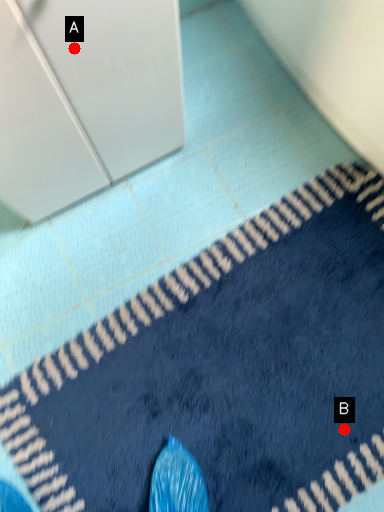
Question: Two points are circled on the image, labeled by A and B beside each circle. Which point is closer to the camera?

Choices:
 (A) A is closer
 (B) B is closer

Answer: (A)